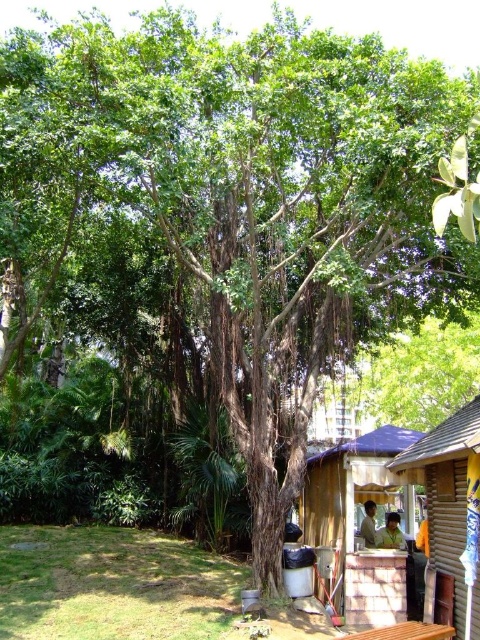
Question: Does wooden hut at lower right have a greater width compared to brown wooden hut at lower right?

Choices:
 (A) no
 (B) yes

Answer: (B)

Question: Which point is closer to the camera?

Choices:
 (A) brown wooden hut at lower right
 (B) wooden hut at lower right

Answer: (A)

Question: Can you confirm if wooden hut at lower right is bigger than brown wooden hut at lower right?

Choices:
 (A) yes
 (B) no

Answer: (A)

Question: Is wooden hut at lower right below brown wooden hut at lower right?

Choices:
 (A) no
 (B) yes

Answer: (B)

Question: Which point is closer to the camera taking this photo?

Choices:
 (A) (452, 477)
 (B) (307, 476)

Answer: (A)